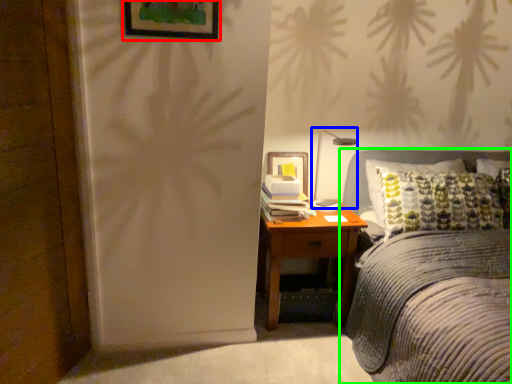
Question: Based on their relative distances, which object is nearer to picture frame (highlighted by a red box)? Choose from bedside lamp (highlighted by a blue box) and bed (highlighted by a green box).

Choices:
 (A) bedside lamp
 (B) bed

Answer: (A)